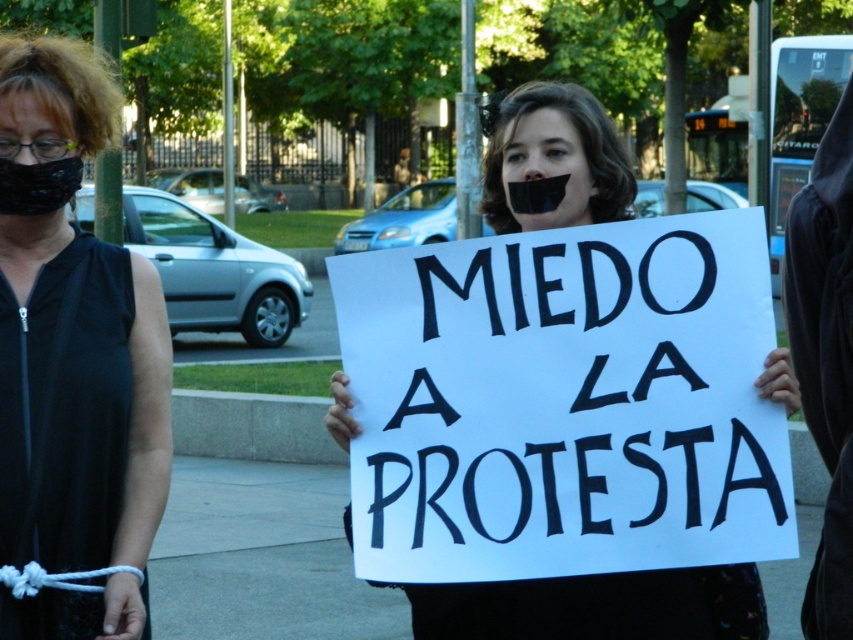
In the scene shown: You are a photographer trying to capture a clear image of the protest signs. You notice two black fabrics in the scene. The black fabric mask at left and the black fabric at center. Which one would block more of the protester wearing it from being seen in your photo?

The black fabric mask at left has a larger width than the black fabric at center, so it would block more of the protester wearing it from being seen in your photo.

You are a photographer standing in the protest scene. You want to take a photo that includes both the point at (73, 593) and the point at (585, 93). Which point should you focus on first to ensure both are in sharp focus?

You should focus on point (73, 593) first because it is closer to the viewer. Since it is closer, focusing on it will ensure that the farther point (585, 93) is also in focus due to the depth of field extending beyond the closer point.

Based on the photo, you are a photographer trying to capture a clear photo of the black fabric at center. There is a black fabric mask at left in the frame. How far apart are these two objects in feet?

The black fabric mask at left is 3.78 feet away from the black fabric at center.